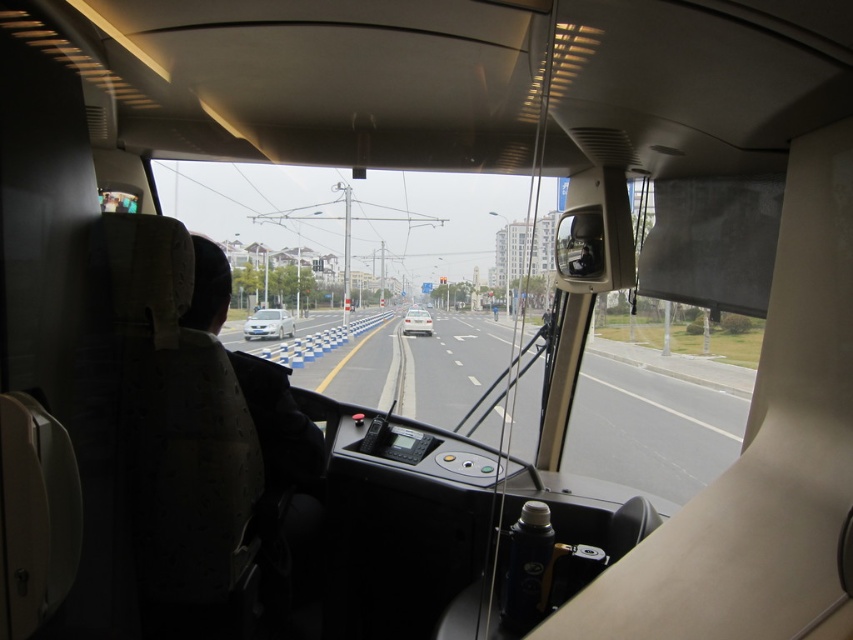
You are a passenger sitting in the front of a bus or tram. You notice a black fabric jacket at left and a white matte car at center through the window. Which object is smaller in size?

The black fabric jacket at left is smaller in size compared to the white matte car at center.

You are a passenger sitting in the front of the vehicle. You want to check the weather outside through the transparent glass windshield at center. However, there is a black fabric jacket at left in your way. Can you move the jacket to see through the windshield?

The transparent glass windshield at center is located above the black fabric jacket at left, so you can move the jacket to the side or adjust its position to see through the windshield without obstruction.

You are a passenger sitting in the front of a bus or tram. You want to reach a bottle located at point (267, 413). Can you safely extend your arm to grab it without touching the dashboard or driver?

The distance between you and the bottle at point (267, 413) is 7.79 feet. Since this distance is greater than the typical arm length of a person, you cannot safely reach it without moving closer. Additionally, attempting to stretch your arm might interfere with the dashboard or the driver, so it is advisable not to attempt this.